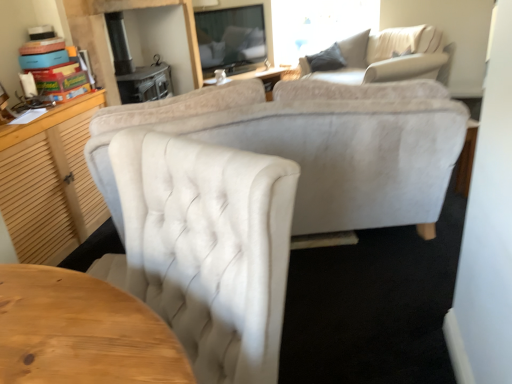
Question: Should I look upward or downward to see velvet white chair at center?

Choices:
 (A) down
 (B) up

Answer: (A)

Question: Considering the relative sizes of velvet white chair at center and velvet beige sofa at upper right in the image provided, is velvet white chair at center shorter than velvet beige sofa at upper right?

Choices:
 (A) yes
 (B) no

Answer: (B)

Question: Is velvet beige sofa at upper right surrounded by velvet white chair at center?

Choices:
 (A) yes
 (B) no

Answer: (B)

Question: Considering the relative sizes of velvet white chair at center and velvet beige sofa at upper right in the image provided, is velvet white chair at center wider than velvet beige sofa at upper right?

Choices:
 (A) yes
 (B) no

Answer: (B)

Question: Is velvet white chair at center looking in the opposite direction of velvet beige sofa at upper right?

Choices:
 (A) no
 (B) yes

Answer: (A)

Question: Is velvet white chair at center smaller than velvet beige sofa at upper right?

Choices:
 (A) yes
 (B) no

Answer: (A)

Question: Can you confirm if velvet white chair at center is taller than velvet beige sofa at upper right?

Choices:
 (A) no
 (B) yes

Answer: (B)

Question: Is velvet beige sofa at upper right to the right of velvet white chair at center from the viewer's perspective?

Choices:
 (A) no
 (B) yes

Answer: (B)

Question: Is velvet white chair at center a part of velvet beige sofa at upper right?

Choices:
 (A) yes
 (B) no

Answer: (B)

Question: From the image's perspective, is velvet beige sofa at upper right below velvet white chair at center?

Choices:
 (A) no
 (B) yes

Answer: (A)

Question: From a real-world perspective, is velvet beige sofa at upper right over velvet white chair at center?

Choices:
 (A) yes
 (B) no

Answer: (B)

Question: Considering the relative positions of velvet beige sofa at upper right and velvet white chair at center in the image provided, is velvet beige sofa at upper right to the left of velvet white chair at center from the viewer's perspective?

Choices:
 (A) yes
 (B) no

Answer: (B)

Question: Can we say velvet beige sofa at upper right lies outside velvet white chair at center?

Choices:
 (A) no
 (B) yes

Answer: (B)

Question: Based on their sizes in the image, would you say velvet white chair at center is bigger or smaller than velvet beige sofa at upper right?

Choices:
 (A) small
 (B) big

Answer: (A)